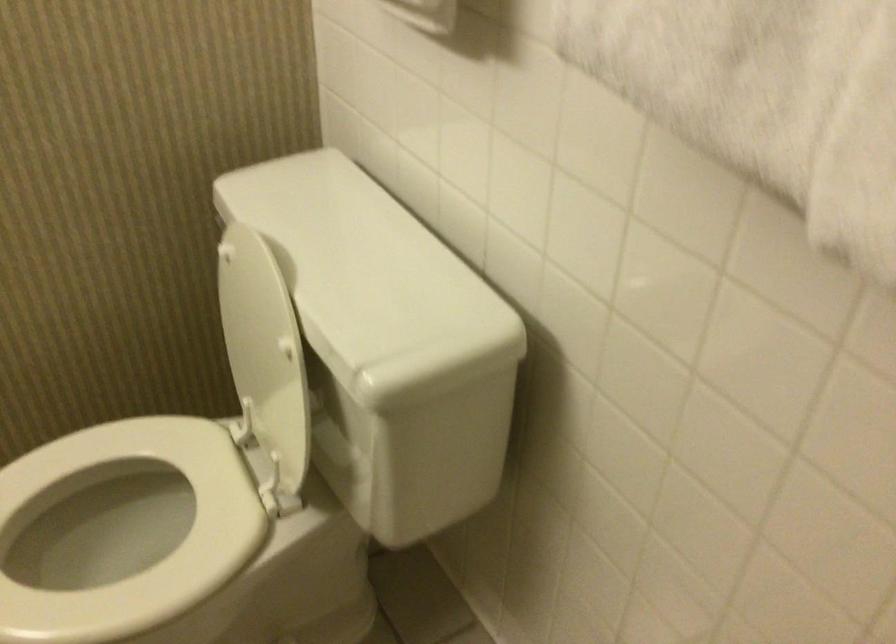
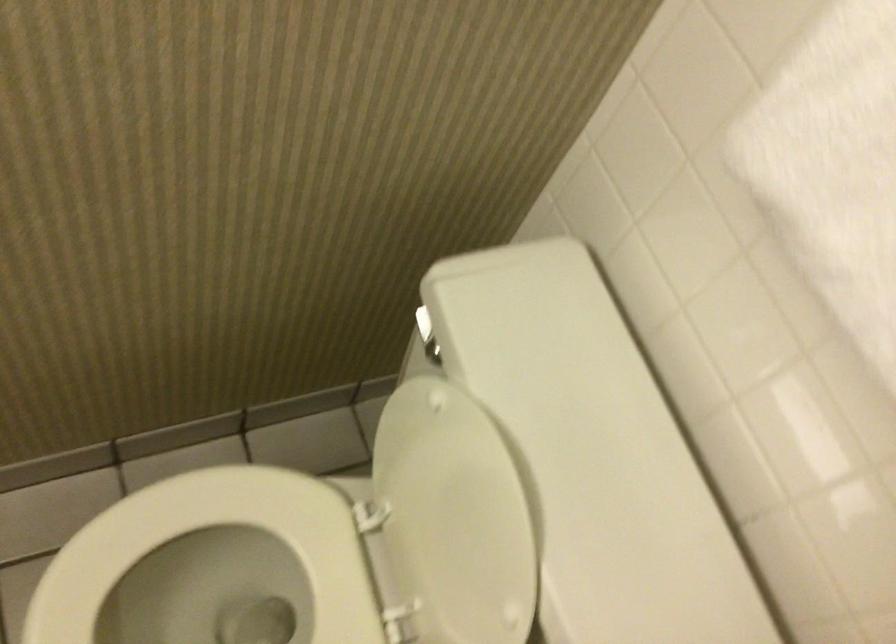
The images are taken continuously from a first-person perspective. In which direction are you moving?

The movement direction of the cameraman is left, forward.